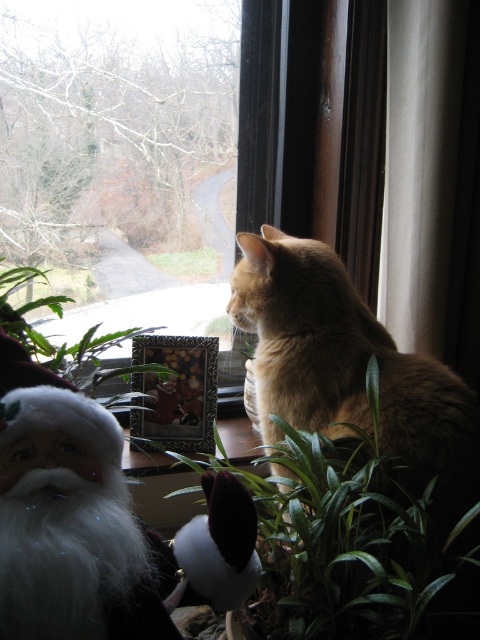
Question: Which object is positioned closest to the green leafy plant at center?

Choices:
 (A) green leafy plant at lower center
 (B) white plush santa at lower left

Answer: (B)

Question: Considering the real-world distances, which object is closest to the green leafy plant at lower center?

Choices:
 (A) green leafy plant at center
 (B) white plush santa at lower left
 (C) golden fur cat at window

Answer: (C)

Question: Can you confirm if green leafy plant at center is wider than green leafy plant at lower center?

Choices:
 (A) yes
 (B) no

Answer: (A)

Question: Is golden fur cat at window thinner than green leafy plant at lower center?

Choices:
 (A) no
 (B) yes

Answer: (A)

Question: Is golden fur cat at window to the right of white plush santa at lower left from the viewer's perspective?

Choices:
 (A) yes
 (B) no

Answer: (A)

Question: Which of the following is the closest to the observer?

Choices:
 (A) green leafy plant at lower center
 (B) golden fur cat at window
 (C) white plush santa at lower left
 (D) green leafy plant at center

Answer: (C)